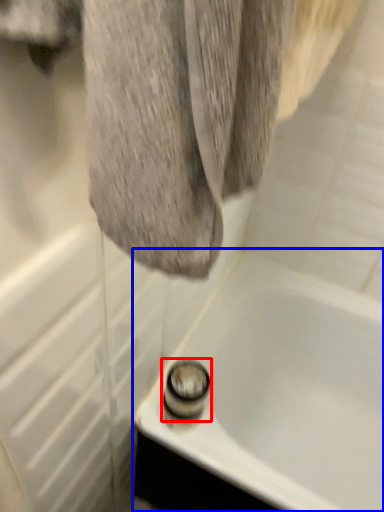
Question: Which object is further to the camera taking this photo, shower (highlighted by a red box) or bathtub (highlighted by a blue box)?

Choices:
 (A) shower
 (B) bathtub

Answer: (A)